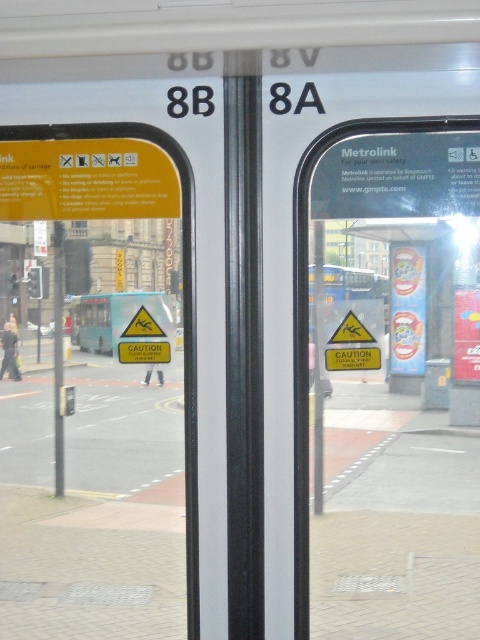
Question: Is yellow caution sign at center below yellow caution sign at left?

Choices:
 (A) yes
 (B) no

Answer: (A)

Question: In this image, where is yellow caution sign at center located relative to yellow caution sign at left?

Choices:
 (A) left
 (B) right

Answer: (B)

Question: Is yellow caution sign at center wider than yellow caution sign at left?

Choices:
 (A) no
 (B) yes

Answer: (A)

Question: Which point is farther from the camera taking this photo?

Choices:
 (A) (192, 248)
 (B) (308, 173)

Answer: (A)